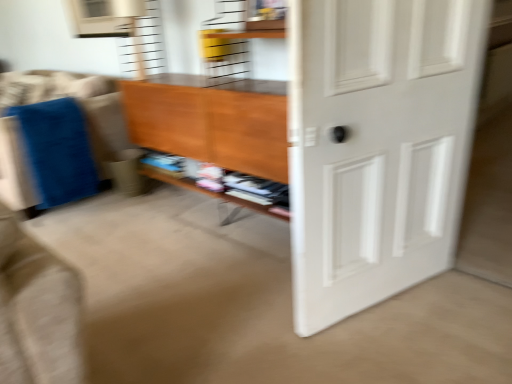
Question: Considering the positions of white matte door at right and wooden shelf at center in the image, is white matte door at right taller or shorter than wooden shelf at center?

Choices:
 (A) tall
 (B) short

Answer: (A)

Question: Is white matte door at right bigger or smaller than wooden shelf at center?

Choices:
 (A) big
 (B) small

Answer: (A)

Question: Does point (448, 132) appear closer or farther from the camera than point (278, 215)?

Choices:
 (A) farther
 (B) closer

Answer: (B)

Question: Considering the positions of wooden shelf at center and white matte door at right in the image, is wooden shelf at center wider or thinner than white matte door at right?

Choices:
 (A) thin
 (B) wide

Answer: (B)

Question: Would you say wooden shelf at center is to the left or to the right of white matte door at right in the picture?

Choices:
 (A) left
 (B) right

Answer: (A)

Question: From a real-world perspective, is wooden shelf at center above or below white matte door at right?

Choices:
 (A) above
 (B) below

Answer: (B)

Question: In the image, is wooden shelf at center positioned in front of or behind white matte door at right?

Choices:
 (A) front
 (B) behind

Answer: (B)